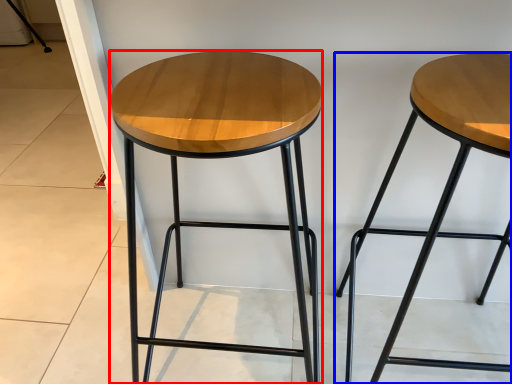
Question: Which of the following is the closest to the observer, stool (highlighted by a red box) or stool (highlighted by a blue box)?

Choices:
 (A) stool
 (B) stool

Answer: (B)